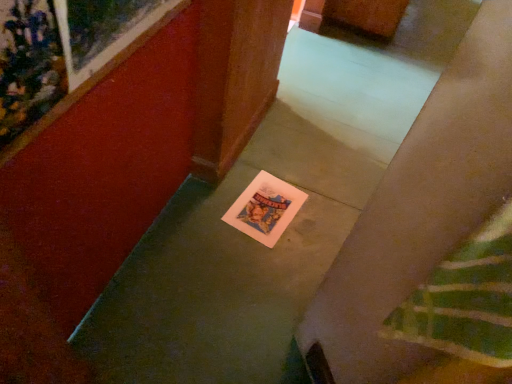
Where is `free location in front of white paper postcard at center`? Image resolution: width=512 pixels, height=384 pixels. free location in front of white paper postcard at center is located at coordinates (249, 258).